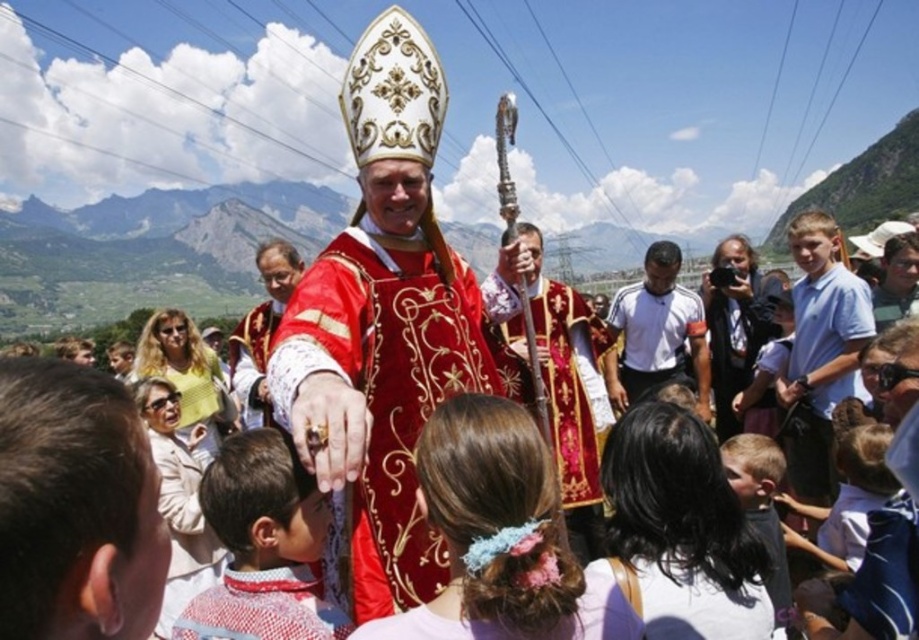
Between light blue cotton shirt at right and white athletic shirt at center, which one has more height?

light blue cotton shirt at right is taller.

Can you confirm if light blue cotton shirt at right is positioned below white athletic shirt at center?

Yes.

Between point (811, 372) and point (673, 356), which one is positioned in front?

Point (811, 372) is in front.

I want to click on light blue cotton shirt at right, so click(x=820, y=352).

Which is more to the right, gold embroidered robe at center or light brown hair at lower right?

light brown hair at lower right

Who is taller, gold embroidered robe at center or light brown hair at lower right?

Standing taller between the two is gold embroidered robe at center.

Identify the location of gold embroidered robe at center. (570, 392).

Between matte gold vestment at center and light blue cotton shirt at right, which one has more height?

With more height is matte gold vestment at center.

Does point (373, 588) come in front of point (830, 326)?

Yes, it is in front of point (830, 326).

Identify the location of matte gold vestment at center. This screenshot has height=640, width=919. (384, 326).